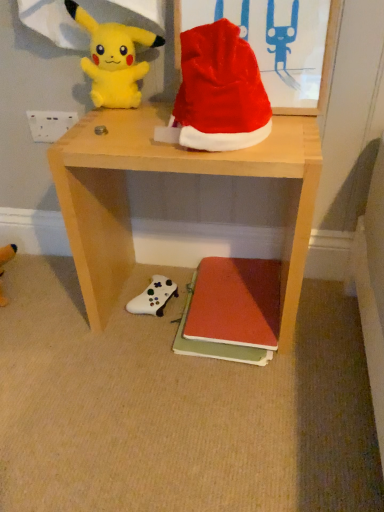
Find the location of a particular element. The width and height of the screenshot is (384, 512). free space behind white matte game controller at lower center, acting as the second toy starting from the front is located at coordinates (159, 268).